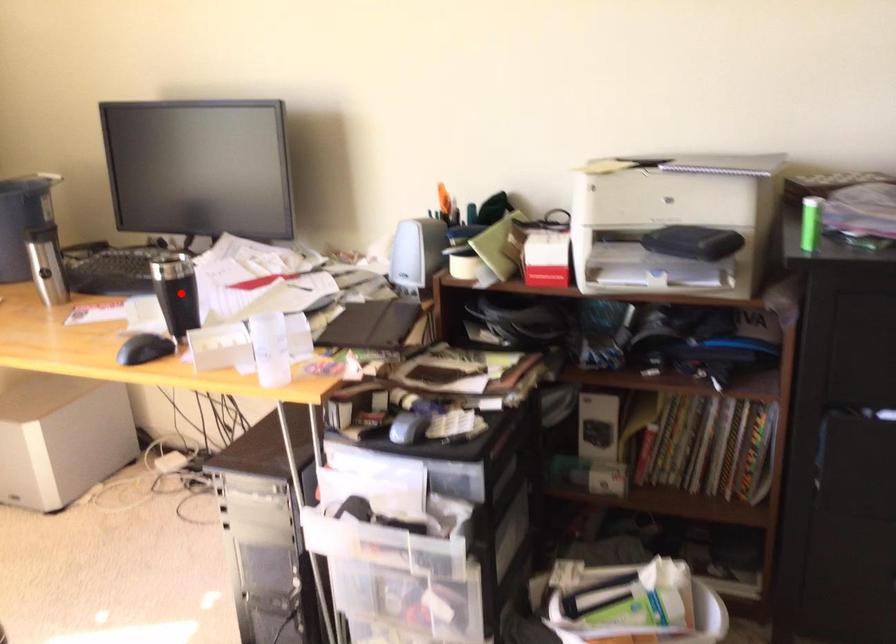
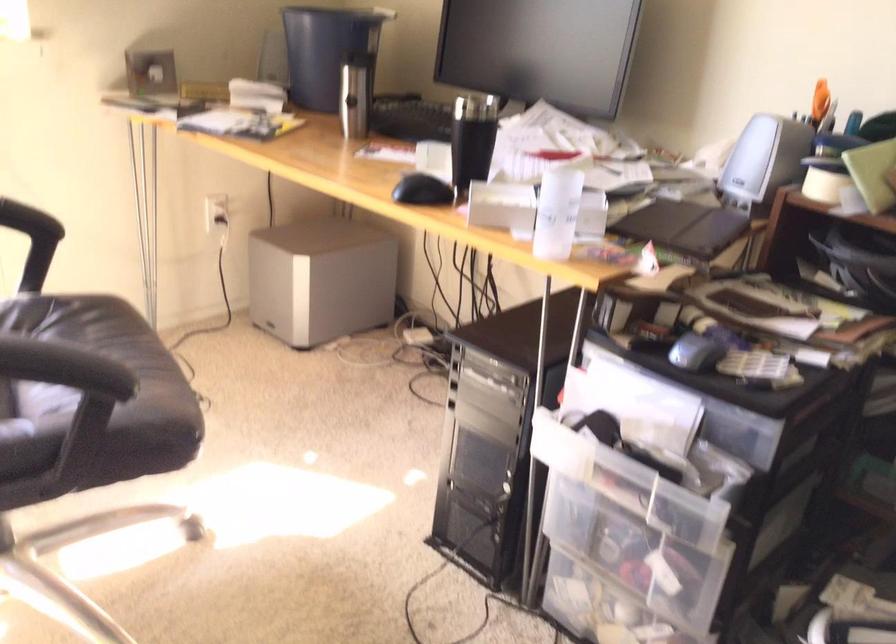
Question: I am providing you with two images of the same scene from different viewpoints. In image1, a red point is highlighted. Considering the same 3D point in image2, which of the following is correct?

Choices:
 (A) It is closer
 (B) It is farther

Answer: (A)